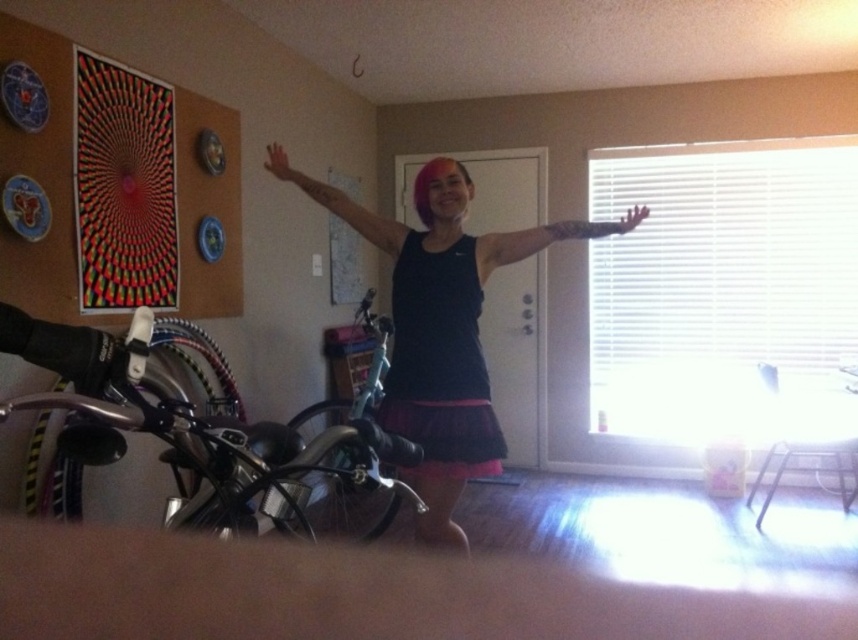
Question: From the image, what is the correct spatial relationship of shiny black bicycle at left in relation to black matte tank top at center?

Choices:
 (A) above
 (B) below

Answer: (B)

Question: Which object appears farthest from the camera in this image?

Choices:
 (A) matte black arm at center
 (B) shiny black bicycle at left

Answer: (A)

Question: Does black matte dress at center appear on the left side of matte black arm at center?

Choices:
 (A) no
 (B) yes

Answer: (A)

Question: Which point appears farthest from the camera in this image?

Choices:
 (A) (270, 144)
 (B) (629, 216)
 (C) (566, 225)

Answer: (A)

Question: Is black matte tank top at center bigger than pink matte hand at upper center?

Choices:
 (A) yes
 (B) no

Answer: (A)

Question: Which point appears farthest from the camera in this image?

Choices:
 (A) (224, 464)
 (B) (461, 272)
 (C) (421, 369)
 (D) (630, 220)

Answer: (D)